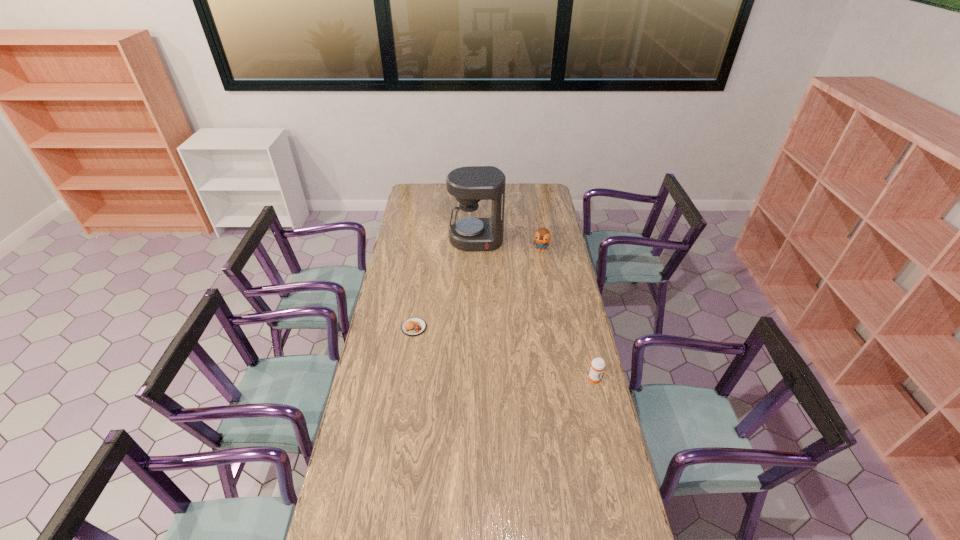
Find the location of a particular element. blank space located 0.250m on the front-facing side of the duck is located at coordinates (527, 286).

This screenshot has width=960, height=540. Identify the location of blank space located on the front-facing side of the duck. (522, 296).

In order to click on vacant space situated 0.190m on the front-facing side of the duck in this screenshot , I will do `click(530, 278)`.

Image resolution: width=960 pixels, height=540 pixels. I want to click on vacant position located on the front-facing side of the tallest object, so click(480, 305).

Locate an element on the screen. Image resolution: width=960 pixels, height=540 pixels. free region located on the front-facing side of the tallest object is located at coordinates (480, 299).

At what (x,y) coordinates should I click in order to perform the action: click on free spot located 0.370m on the front-facing side of the tallest object. Please return your answer as a coordinate pair (x, y). The width and height of the screenshot is (960, 540). Looking at the image, I should click on (480, 300).

Where is `object that is at the left edge`? Image resolution: width=960 pixels, height=540 pixels. object that is at the left edge is located at coordinates (414, 326).

Find the location of a particular element. medicine located in the right edge section of the desktop is located at coordinates (597, 365).

At what (x,y) coordinates should I click in order to perform the action: click on duck located in the right edge section of the desktop. Please return your answer as a coordinate pair (x, y). The image size is (960, 540). Looking at the image, I should click on click(x=542, y=236).

Identify the location of free space at the near edge of the desktop. (535, 519).